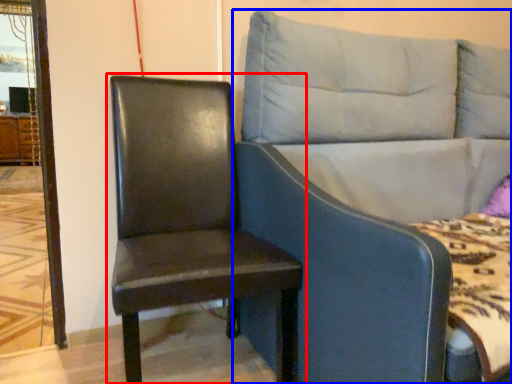
Question: Among these objects, which one is farthest to the camera, chair (highlighted by a red box) or studio couch (highlighted by a blue box)?

Choices:
 (A) chair
 (B) studio couch

Answer: (A)